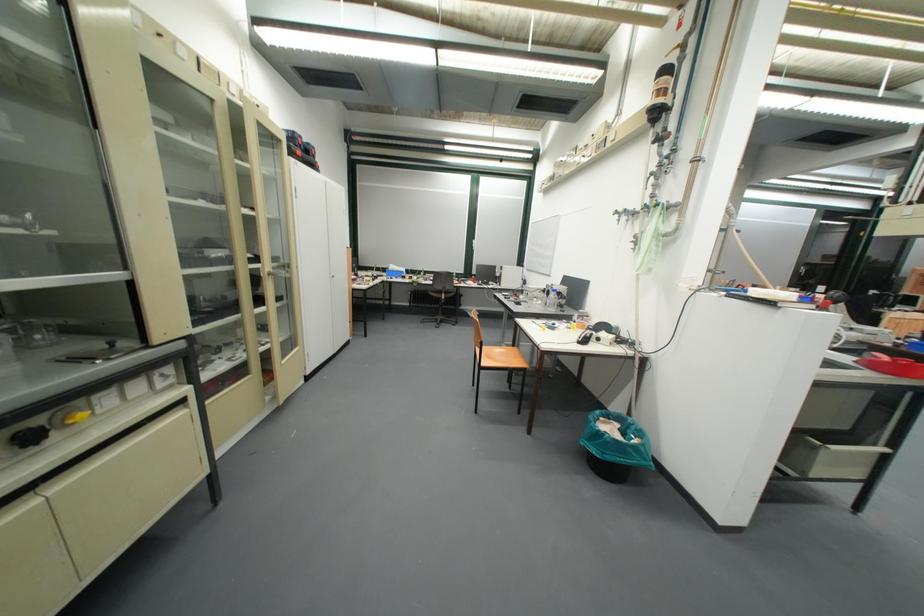
The height and width of the screenshot is (616, 924). Describe the element at coordinates (30, 436) in the screenshot. I see `a black control knob` at that location.